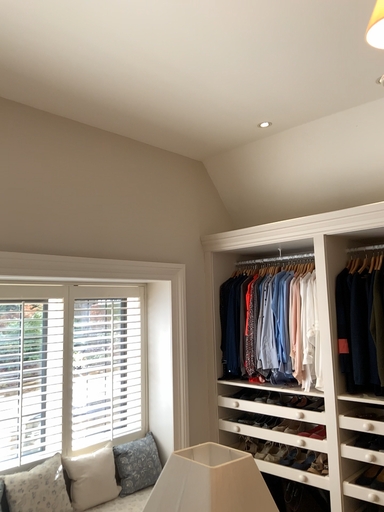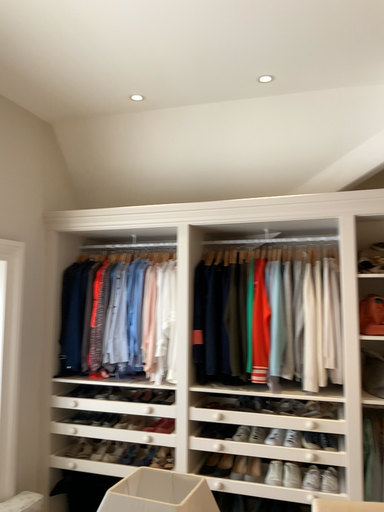
Question: Which way did the camera rotate in the video?

Choices:
 (A) rotated left
 (B) rotated right

Answer: (B)